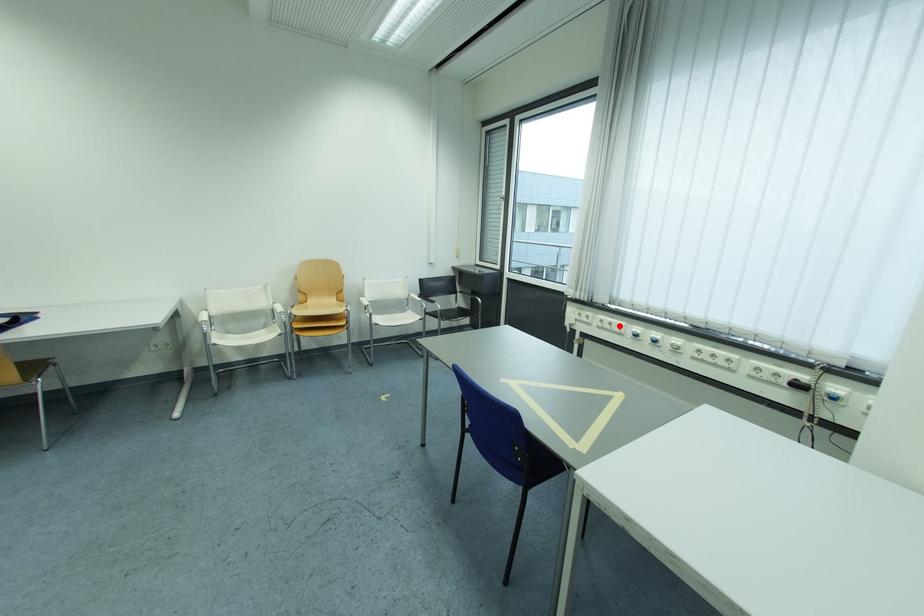
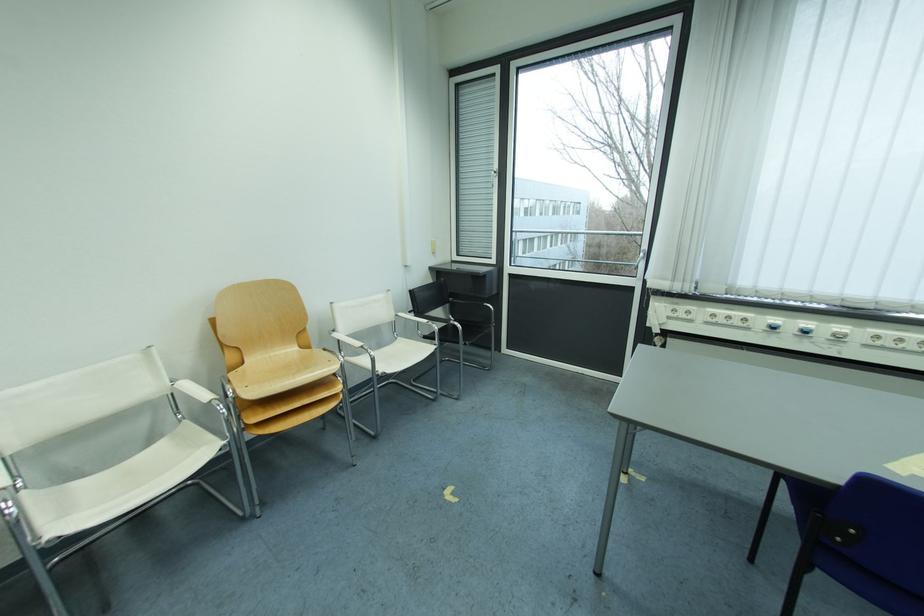
Find the pixel in the second image that matches the highlighted location in the first image.

(737, 320)